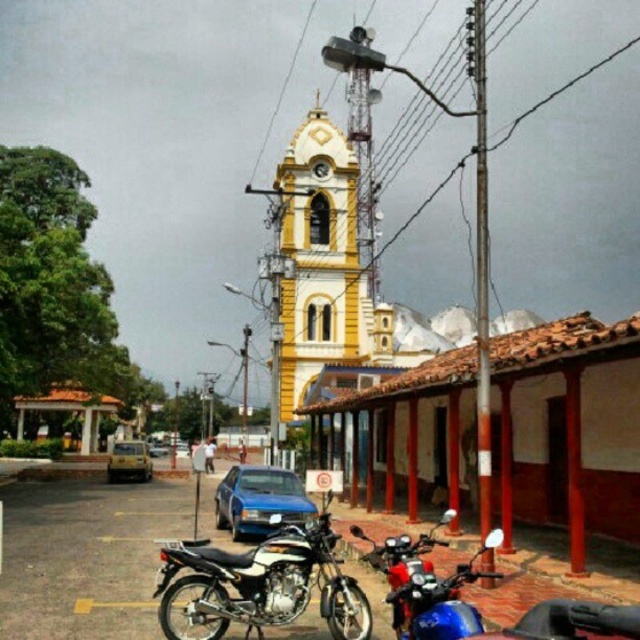
Question: Does shiny chrome motorcycle at center appear under yellow matte taxi at center?

Choices:
 (A) yes
 (B) no

Answer: (A)

Question: Is yellow painted stone clock tower at center to the left of yellow matte taxi at center from the viewer's perspective?

Choices:
 (A) no
 (B) yes

Answer: (A)

Question: Which point appears closest to the camera in this image?

Choices:
 (A) coord(282,616)
 (B) coord(451,608)
 (C) coord(300,480)
 (D) coord(330,212)

Answer: (B)

Question: Which point is farther from the camera taking this photo?

Choices:
 (A) (477, 630)
 (B) (209, 637)

Answer: (B)

Question: Does blue matte car at lower center appear on the right side of yellow matte taxi at center?

Choices:
 (A) yes
 (B) no

Answer: (A)

Question: Among these points, which one is farthest from the camera?

Choices:
 (A) (161, 595)
 (B) (230, 477)

Answer: (B)